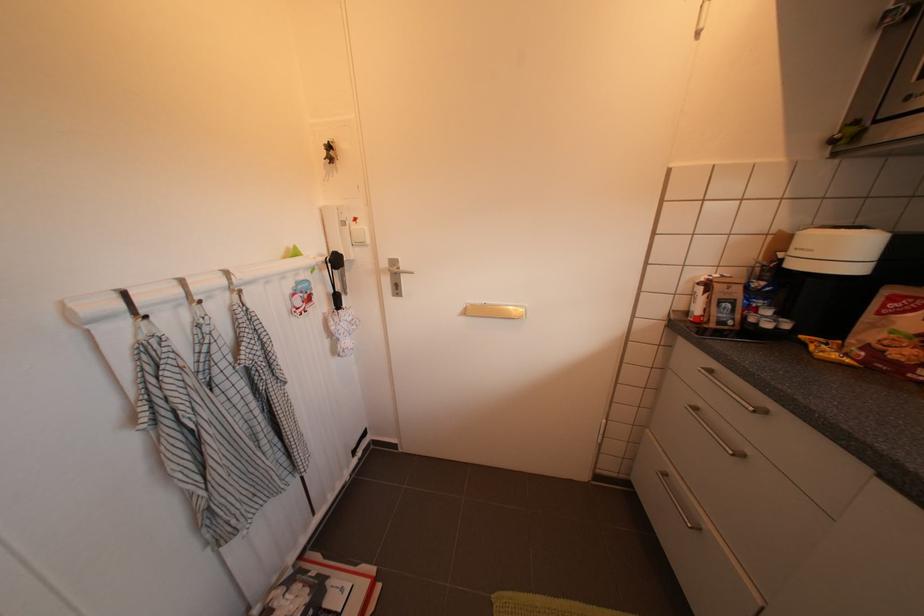
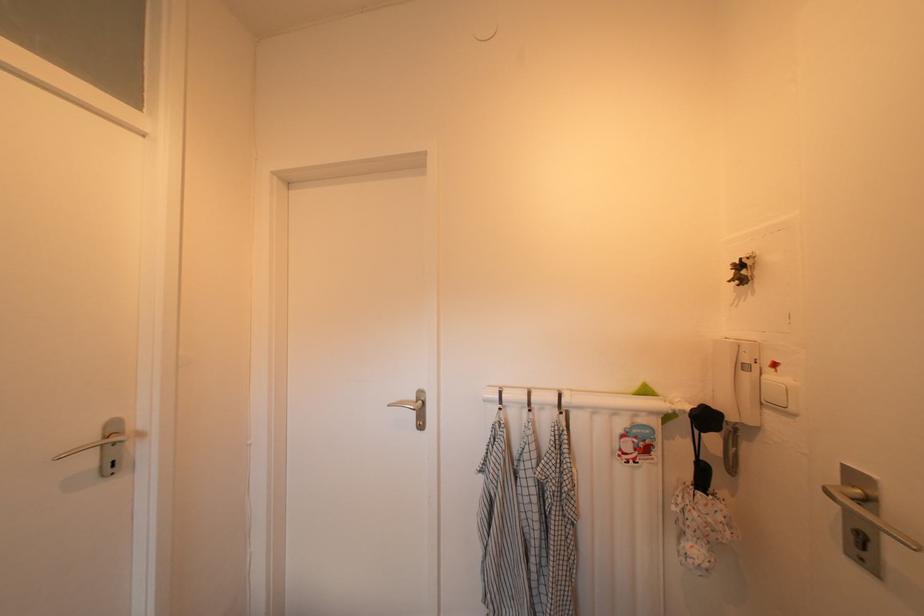
Question: The camera is either moving clockwise (left) or counter-clockwise (right) around the object. The first image is from the beginning of the video and the second image is from the end. Is the camera moving left or right when shooting the video?

Choices:
 (A) Left
 (B) Right

Answer: (B)